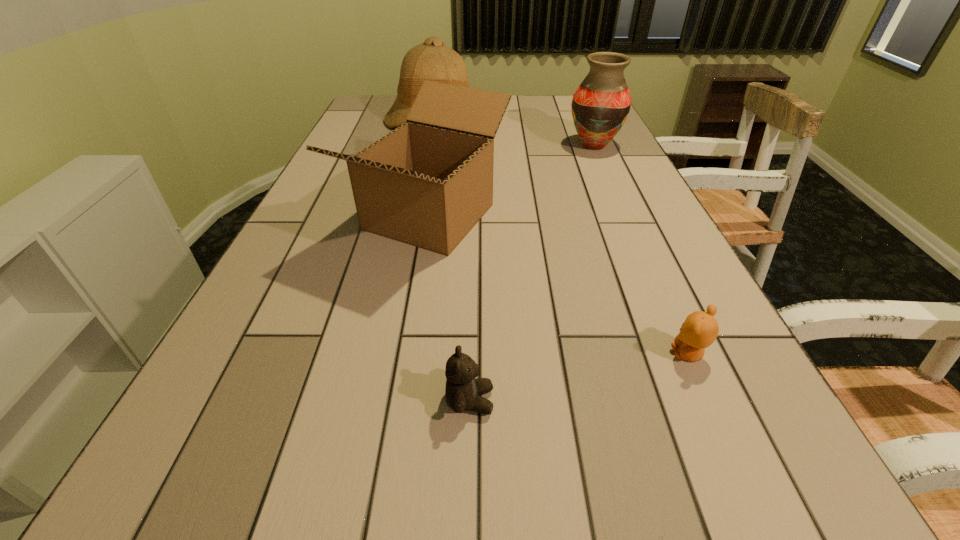
Find the location of a particular element. The height and width of the screenshot is (540, 960). vacant point located 0.250m on the face of the nearest object is located at coordinates (653, 401).

I want to click on vacant space located 0.100m on the face of the right teddy bear, so click(x=612, y=354).

Where is `vacant space located on the face of the right teddy bear`? vacant space located on the face of the right teddy bear is located at coordinates (601, 354).

The width and height of the screenshot is (960, 540). In order to click on free spot located 0.370m on the face of the right teddy bear in this screenshot , I will do (x=456, y=354).

This screenshot has height=540, width=960. I want to click on object that is at the far edge, so click(433, 61).

Where is `hat at the left edge`? This screenshot has width=960, height=540. hat at the left edge is located at coordinates (433, 61).

At what (x,y) coordinates should I click in order to perform the action: click on box present at the left edge. Please return your answer as a coordinate pair (x, y). Looking at the image, I should click on (427, 183).

The image size is (960, 540). In order to click on vase that is at the right edge in this screenshot , I will do `click(601, 104)`.

You are a GUI agent. You are given a task and a screenshot of the screen. Output one action in this format:
    pyautogui.click(x=<x>, y=<y>)
    Task: Click on the teddy bear located in the right edge section of the desktop
    Image resolution: width=960 pixels, height=540 pixels.
    Given the screenshot: What is the action you would take?
    pyautogui.click(x=700, y=329)

The width and height of the screenshot is (960, 540). In order to click on object that is at the far left corner in this screenshot , I will do `click(433, 61)`.